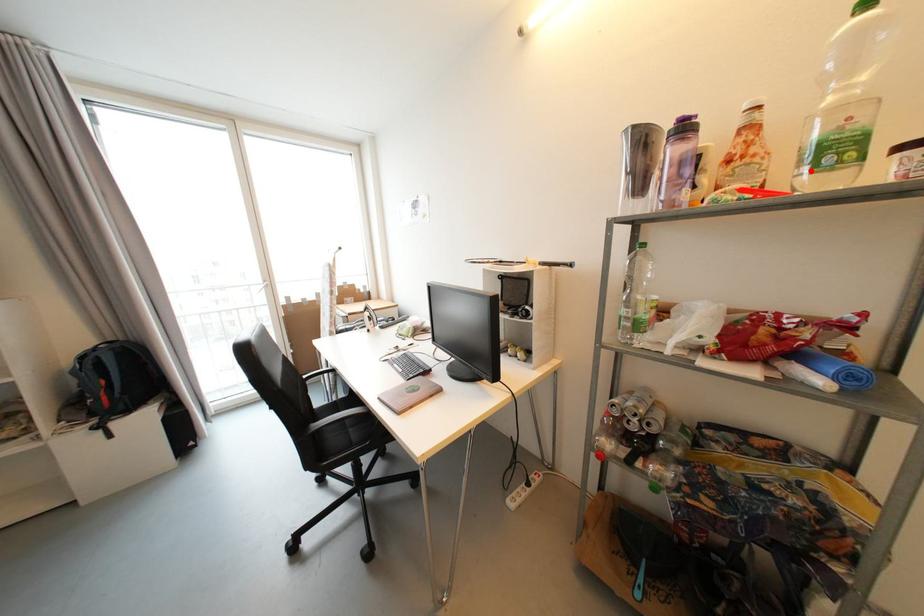
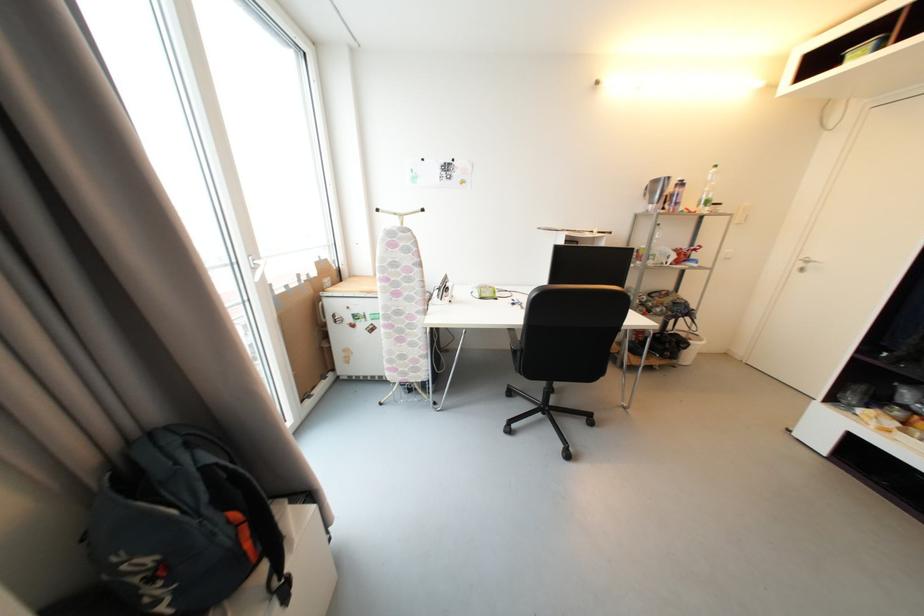
Where in the second image is the point corresponding to the highlighted location from the first image?

(707, 208)